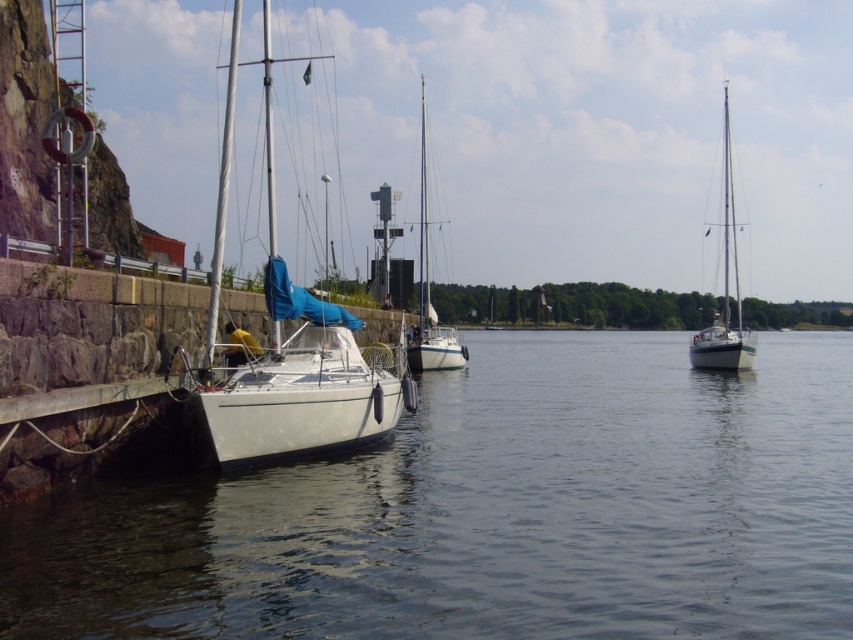
You are a sailor planning to anchor your boat at the marina. You need to know if the clear water at dock left is located below the white glossy sailboat at right to avoid hitting the boat. Can you confirm this?

Yes, the clear water at dock left is positioned under the white glossy sailboat at right, so anchoring there would place your boat below it, avoiding a collision.

You are standing on the pier and see the white matte sailboat at left and the white glossy sailboat at center. Which one is positioned to the left side?

The white matte sailboat at left is positioned to the left of the white glossy sailboat at center.